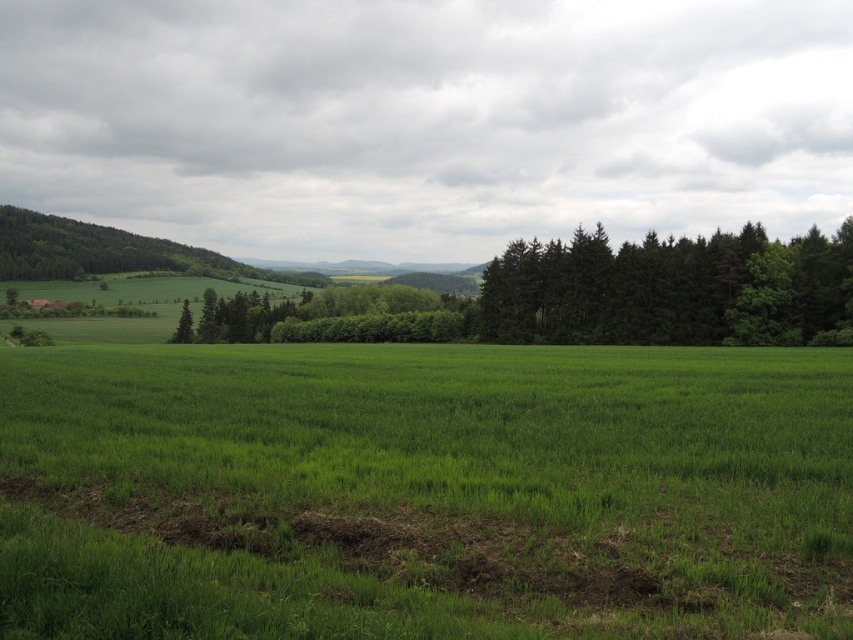
Question: Estimate the real-world distances between objects in this image. Which object is farther from the green leafy forest at left?

Choices:
 (A) green matte forest at right
 (B) green grassy field at center

Answer: (B)

Question: Is green grassy field at center above green matte forest at right?

Choices:
 (A) no
 (B) yes

Answer: (A)

Question: Considering the relative positions of green grassy field at center and green leafy forest at left in the image provided, where is green grassy field at center located with respect to green leafy forest at left?

Choices:
 (A) left
 (B) right

Answer: (B)

Question: Is green matte forest at right wider than green leafy forest at left?

Choices:
 (A) yes
 (B) no

Answer: (B)

Question: Which point is closer to the camera?

Choices:
 (A) (595, 243)
 (B) (62, 237)
 (C) (16, 492)

Answer: (C)

Question: Which point is farther from the camera taking this photo?

Choices:
 (A) (810, 228)
 (B) (434, 394)

Answer: (A)